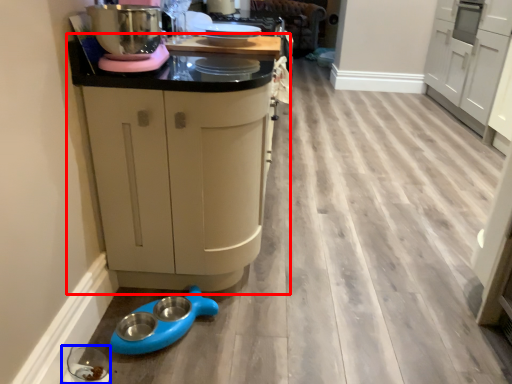
Question: Which point is further to the camera, cabinetry (highlighted by a red box) or appliance (highlighted by a blue box)?

Choices:
 (A) cabinetry
 (B) appliance

Answer: (B)